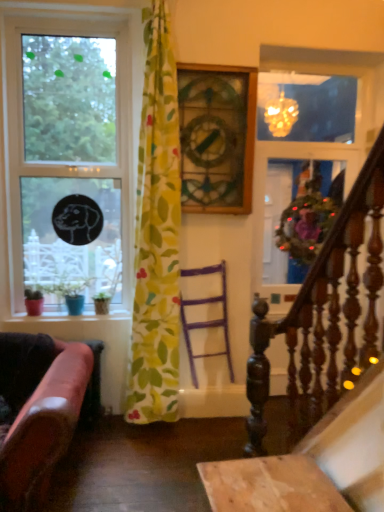
Find the location of a particular element. The height and width of the screenshot is (512, 384). purple wood chair at center is located at coordinates (206, 321).

Measure the distance between point (278,204) and camera.

3.42 meters.

Describe the element at coordinates (289, 224) in the screenshot. I see `decorative wreath at upper right` at that location.

What do you see at coordinates (322, 316) in the screenshot? I see `dark wood railing at right` at bounding box center [322, 316].

The image size is (384, 512). What do you see at coordinates (40, 410) in the screenshot?
I see `leather at left` at bounding box center [40, 410].

This screenshot has height=512, width=384. What do you see at coordinates (156, 234) in the screenshot?
I see `yellow floral fabric at center` at bounding box center [156, 234].

Identify the location of purple wood chair at center. This screenshot has width=384, height=512. (206, 321).

Is clear glass window at left turned away from yellow floral fabric at center?

No.

From a real-world perspective, is clear glass window at left above or below yellow floral fabric at center?

clear glass window at left is situated higher than yellow floral fabric at center in the real world.

Considering the positions of objects clear glass window at left and yellow floral fabric at center in the image provided, who is behind, clear glass window at left or yellow floral fabric at center?

Positioned behind is clear glass window at left.

From the image's perspective, is clear glass window at left above or below yellow floral fabric at center?

From the image's perspective, clear glass window at left appears above yellow floral fabric at center.

Considering the relative sizes of dark wood railing at right and decorative wreath at upper right in the image provided, is dark wood railing at right taller than decorative wreath at upper right?

Indeed, dark wood railing at right has a greater height compared to decorative wreath at upper right.

At what (x,y) coordinates should I click in order to perform the action: click on glass door that appears on the right of dark wood railing at right. Please return your answer as a coordinate pair (x, y). This screenshot has width=384, height=512. Looking at the image, I should click on (289, 224).

Based on the photo, considering the relative positions of dark wood railing at right and decorative wreath at upper right in the image provided, is dark wood railing at right to the left of decorative wreath at upper right from the viewer's perspective?

Correct, you'll find dark wood railing at right to the left of decorative wreath at upper right.

Considering the relative sizes of dark wood railing at right and decorative wreath at upper right in the image provided, is dark wood railing at right wider than decorative wreath at upper right?

Incorrect, the width of dark wood railing at right does not surpass that of decorative wreath at upper right.

From the image's perspective, is clear glass window at left under leather at left?

Actually, clear glass window at left appears above leather at left in the image.

Identify the location of studio couch that appears below the clear glass window at left (from the image's perspective). (40, 410).

Looking at this image, from the image's perspective, which is below, clear glass window at left or decorative wreath at upper right?

decorative wreath at upper right.

Is clear glass window at left placed right next to decorative wreath at upper right?

They are not placed beside each other.

Is point (39, 83) closer or farther from the camera than point (257, 196)?

Point (39, 83).

Looking at this image, from a real-world perspective, who is located lower, clear glass window at left or decorative wreath at upper right?

From a 3D spatial view, decorative wreath at upper right is below.

Would you consider decorative wreath at upper right to be distant from leather at left?

decorative wreath at upper right is positioned a significant distance from leather at left.

Can leather at left be found inside decorative wreath at upper right?

That's incorrect, leather at left is not inside decorative wreath at upper right.

Considering the positions of point (316, 231) and point (67, 400), is point (316, 231) closer or farther from the camera than point (67, 400)?

Point (316, 231).

From a real-world perspective, who is located lower, decorative wreath at upper right or leather at left?

leather at left is physically lower.

Who is bigger, decorative wreath at upper right or clear glass window at left?

clear glass window at left.

From the image's perspective, is decorative wreath at upper right above or below clear glass window at left?

decorative wreath at upper right is below clear glass window at left.

Does decorative wreath at upper right touch clear glass window at left?

No, decorative wreath at upper right is not with clear glass window at left.

Does decorative wreath at upper right appear on the right side of clear glass window at left?

Indeed, decorative wreath at upper right is positioned on the right side of clear glass window at left.

Is purple wood chair at center taller or shorter than yellow floral fabric at center?

Clearly, purple wood chair at center is shorter compared to yellow floral fabric at center.

Considering the relative positions of purple wood chair at center and yellow floral fabric at center in the image provided, is purple wood chair at center in front of yellow floral fabric at center?

No, it is behind yellow floral fabric at center.

Is purple wood chair at center oriented towards yellow floral fabric at center?

No, purple wood chair at center is not turned towards yellow floral fabric at center.

Find the location of a particular element. The height and width of the screenshot is (512, 384). curtain that appears on the right of clear glass window at left is located at coordinates (156, 234).

I want to click on glass door above the dark wood railing at right (from a real-world perspective), so click(x=289, y=224).

Considering their positions, is leather at left positioned closer to clear glass window at left than yellow floral fabric at center?

The object closer to clear glass window at left is yellow floral fabric at center.

Based on their spatial positions, is decorative wreath at upper right or yellow floral fabric at center closer to clear glass window at left?

Based on the image, yellow floral fabric at center appears to be nearer to clear glass window at left.

Which object lies nearer to the anchor point decorative wreath at upper right, purple wood chair at center or leather at left?

purple wood chair at center is closer to decorative wreath at upper right.

From the image, which object appears to be nearer to dark wood railing at right, yellow floral fabric at center or leather at left?

yellow floral fabric at center is closer to dark wood railing at right.

Looking at the image, which one is located closer to decorative wreath at upper right, clear glass window at left or yellow floral fabric at center?

Among the two, yellow floral fabric at center is located nearer to decorative wreath at upper right.

Based on their spatial positions, is clear glass window at left or purple wood chair at center further from yellow floral fabric at center?

The object further to yellow floral fabric at center is clear glass window at left.

Looking at the image, which one is located further to leather at left, yellow floral fabric at center or dark wood railing at right?

dark wood railing at right is positioned further to the anchor leather at left.

In the scene shown: Based on their spatial positions, is leather at left or dark wood railing at right closer to clear glass window at left?

leather at left is positioned closer to the anchor clear glass window at left.

This screenshot has width=384, height=512. Identify the location of armchair between clear glass window at left and dark wood railing at right from left to right. (206, 321).

Locate an element on the screen. This screenshot has height=512, width=384. armchair between yellow floral fabric at center and leather at left in the up-down direction is located at coordinates (206, 321).

Where is `armchair between clear glass window at left and leather at left in the up-down direction`? armchair between clear glass window at left and leather at left in the up-down direction is located at coordinates (206, 321).

You are a GUI agent. You are given a task and a screenshot of the screen. Output one action in this format:
    pyautogui.click(x=<x>, y=<y>)
    Task: Click on the rail situated between yellow floral fabric at center and decorative wreath at upper right from left to right
    This screenshot has height=512, width=384.
    Given the screenshot: What is the action you would take?
    pyautogui.click(x=322, y=316)